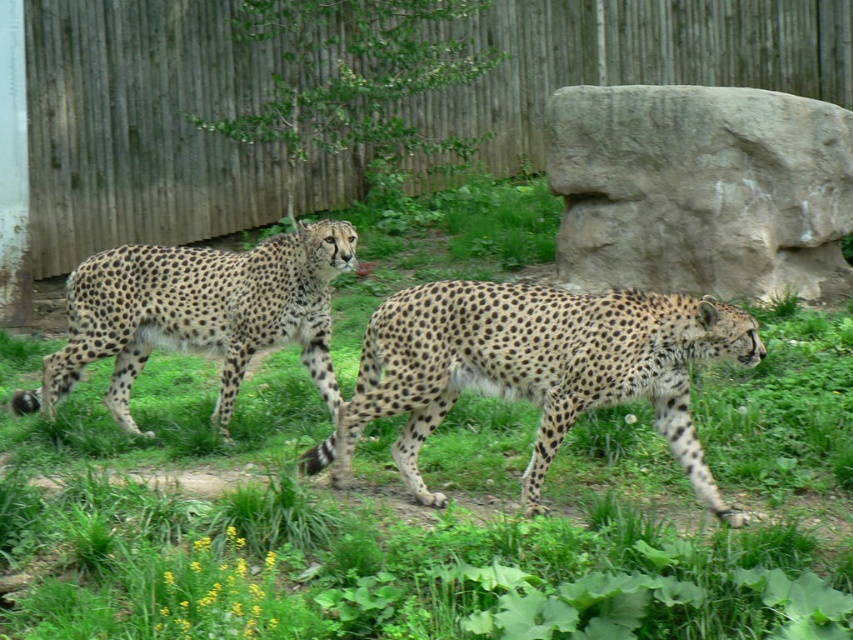
Question: Does gray stone boulder at right come behind spotted fur cheetah at center?

Choices:
 (A) no
 (B) yes

Answer: (B)

Question: Which point is closer to the camera taking this photo?

Choices:
 (A) (335, 240)
 (B) (577, 211)
 (C) (749, 348)

Answer: (C)

Question: Where is gray stone boulder at right located in relation to spotted fur cheetah at left in the image?

Choices:
 (A) below
 (B) above

Answer: (B)

Question: Which point is closer to the camera?

Choices:
 (A) (134, 428)
 (B) (387, 413)
 (C) (799, 116)

Answer: (B)

Question: Which point is farther to the camera?

Choices:
 (A) (x=700, y=243)
 (B) (x=665, y=406)

Answer: (A)

Question: Does gray stone boulder at right lie behind spotted fur cheetah at center?

Choices:
 (A) yes
 (B) no

Answer: (A)